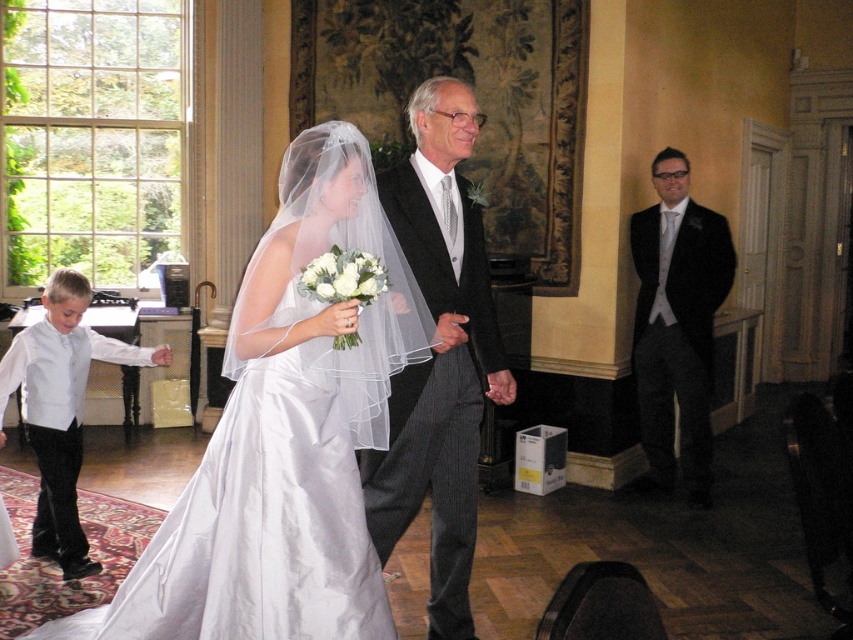
Question: Considering the real-world distances, which object is closest to the dark gray pinstripe suit at center?

Choices:
 (A) satin dress at center
 (B) matte black suit at right

Answer: (A)

Question: Is dark gray pinstripe suit at center closer to the viewer compared to matte black suit at right?

Choices:
 (A) no
 (B) yes

Answer: (B)

Question: Among these points, which one is farthest from the camera?

Choices:
 (A) (264, 556)
 (B) (445, 598)

Answer: (B)

Question: Where is satin dress at center located in relation to matte black suit at right in the image?

Choices:
 (A) below
 (B) above

Answer: (A)

Question: Which of the following is the closest to the observer?

Choices:
 (A) dark gray pinstripe suit at center
 (B) matte black suit at right

Answer: (A)

Question: Does dark gray pinstripe suit at center appear under matte black suit at right?

Choices:
 (A) yes
 (B) no

Answer: (A)